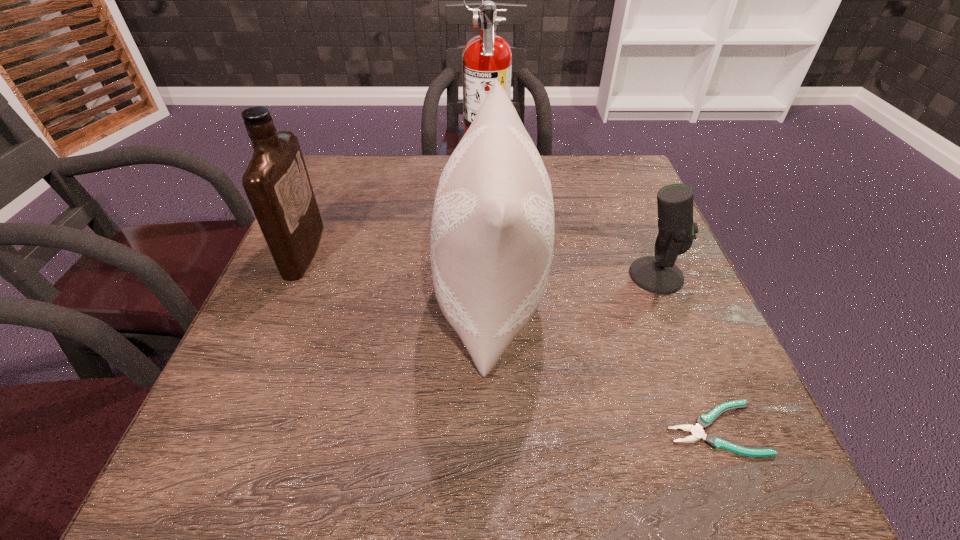
I want to click on free space between the pliers and the tallest object, so click(x=600, y=301).

The width and height of the screenshot is (960, 540). In order to click on unoccupied position between the farthest object and the liquor in this screenshot , I will do `click(396, 213)`.

This screenshot has height=540, width=960. What are the coordinates of `free spot between the cushion and the fourth tallest object` in the screenshot? It's located at (573, 287).

In order to click on unoccupied area between the cushion and the pliers in this screenshot , I will do `click(602, 363)`.

At what (x,y) coordinates should I click in order to perform the action: click on free spot between the pliers and the cushion. Please return your answer as a coordinate pair (x, y). Looking at the image, I should click on (602, 363).

Where is `free point between the pliers and the cushion`? This screenshot has height=540, width=960. free point between the pliers and the cushion is located at coordinates (602, 363).

Where is `the fourth closest object relative to the cushion`? This screenshot has width=960, height=540. the fourth closest object relative to the cushion is located at coordinates click(x=276, y=181).

Locate an element on the screen. Image resolution: width=960 pixels, height=540 pixels. object that is the second closest to the shortest object is located at coordinates 658,274.

Where is `free spot that satisfies the following two spatial constraints: 1. on the nozzle side of the tallest object; 2. on the back side of the microphone`? The height and width of the screenshot is (540, 960). free spot that satisfies the following two spatial constraints: 1. on the nozzle side of the tallest object; 2. on the back side of the microphone is located at coordinates (489, 275).

You are a GUI agent. You are given a task and a screenshot of the screen. Output one action in this format:
    pyautogui.click(x=<x>, y=<y>)
    Task: Click on the vacant area that satisfies the following two spatial constraints: 1. on the back side of the shortest object; 2. on the left side of the microphone
    The height and width of the screenshot is (540, 960).
    Given the screenshot: What is the action you would take?
    pyautogui.click(x=652, y=275)